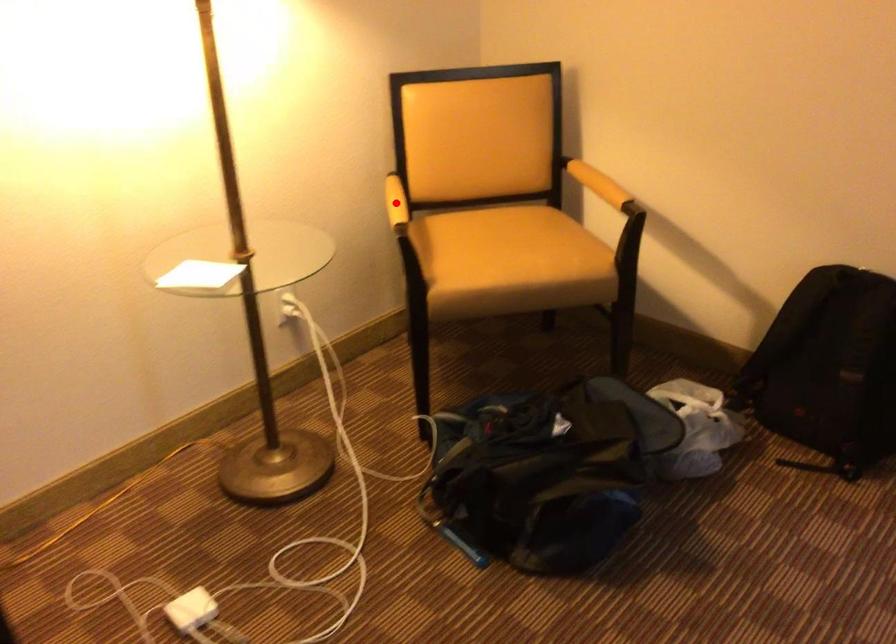
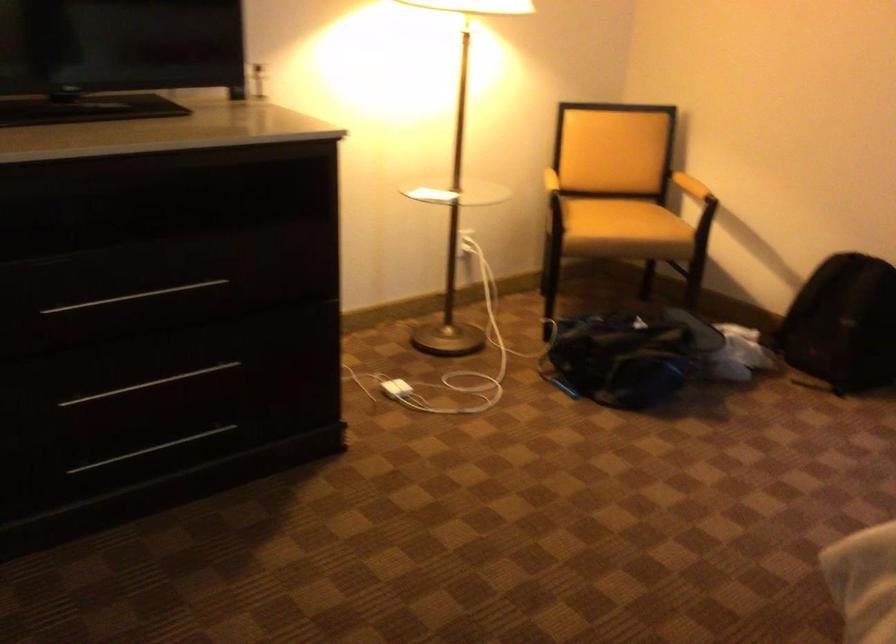
Question: I am providing you with two images of the same scene from different viewpoints. A red point is shown in image1. For the corresponding object point in image2, is it positioned nearer or farther from the camera?

Choices:
 (A) Nearer
 (B) Farther

Answer: (B)